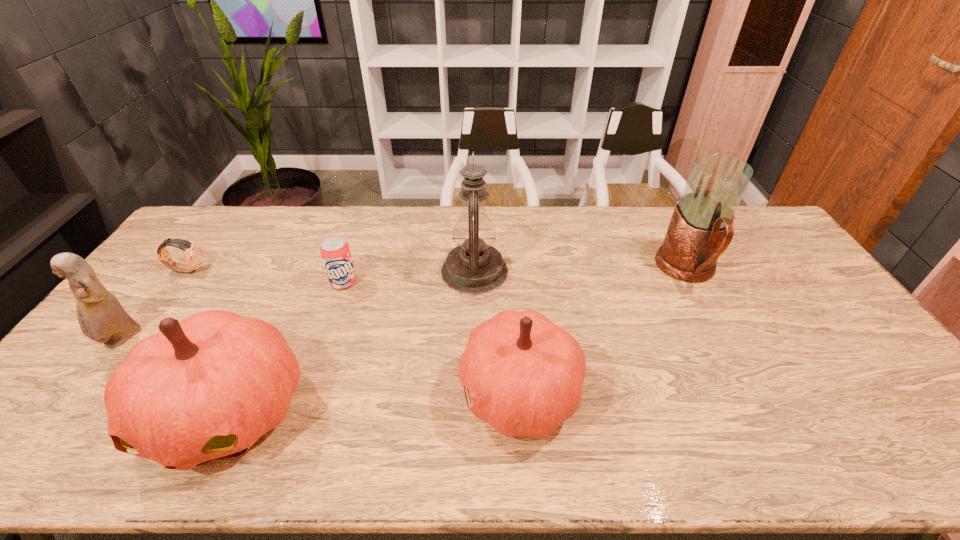
Locate an element on the screen. The width and height of the screenshot is (960, 540). free spot at the far left corner of the desktop is located at coordinates (199, 232).

Where is `vacant region at the far right corner of the desktop`? This screenshot has height=540, width=960. vacant region at the far right corner of the desktop is located at coordinates (758, 223).

The height and width of the screenshot is (540, 960). In the image, there is a desktop. Find the location of `vacant space at the near right corner`. vacant space at the near right corner is located at coordinates (892, 389).

Find the location of `unoccupied position between the second shortest object and the oil lamp`. unoccupied position between the second shortest object and the oil lamp is located at coordinates (409, 277).

At what (x,y) coordinates should I click in order to perform the action: click on free space that is in between the figurine and the second shortest object. Please return your answer as a coordinate pair (x, y). The image size is (960, 540). Looking at the image, I should click on (232, 311).

In order to click on empty location between the figurine and the soda can in this screenshot , I will do [232, 311].

Find the location of `vacant area between the shorter pumpkin and the pitcher`. vacant area between the shorter pumpkin and the pitcher is located at coordinates (604, 331).

In order to click on empty space that is in between the rightmost object and the second shortest object in this screenshot , I will do point(516,276).

Locate an element on the screen. free area in between the shorter pumpkin and the watch is located at coordinates (353, 331).

Locate an element on the screen. vacant space that is in between the right pumpkin and the figurine is located at coordinates tap(320, 366).